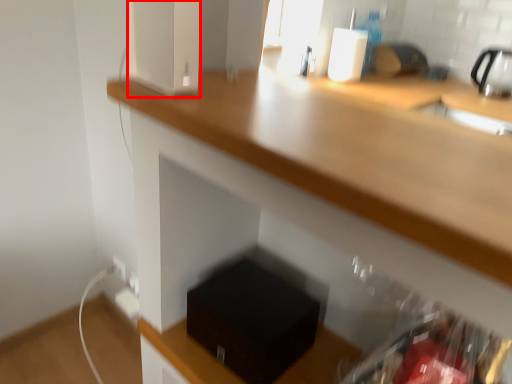
Question: From the image's perspective, what is the correct spatial positioning of appliance (annotated by the red box) in reference to box?

Choices:
 (A) below
 (B) above

Answer: (B)